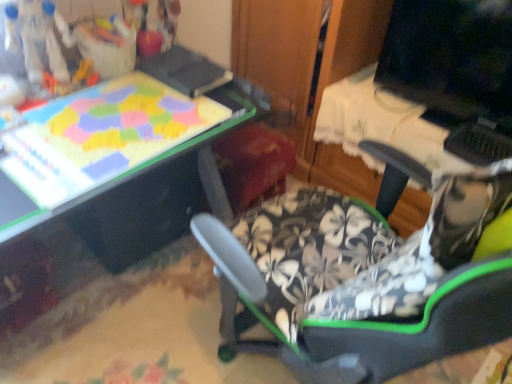
Where is `blank area beneath matte plastic puzzle board at upper left (from a real-world perspective)`? This screenshot has height=384, width=512. blank area beneath matte plastic puzzle board at upper left (from a real-world perspective) is located at coordinates (111, 134).